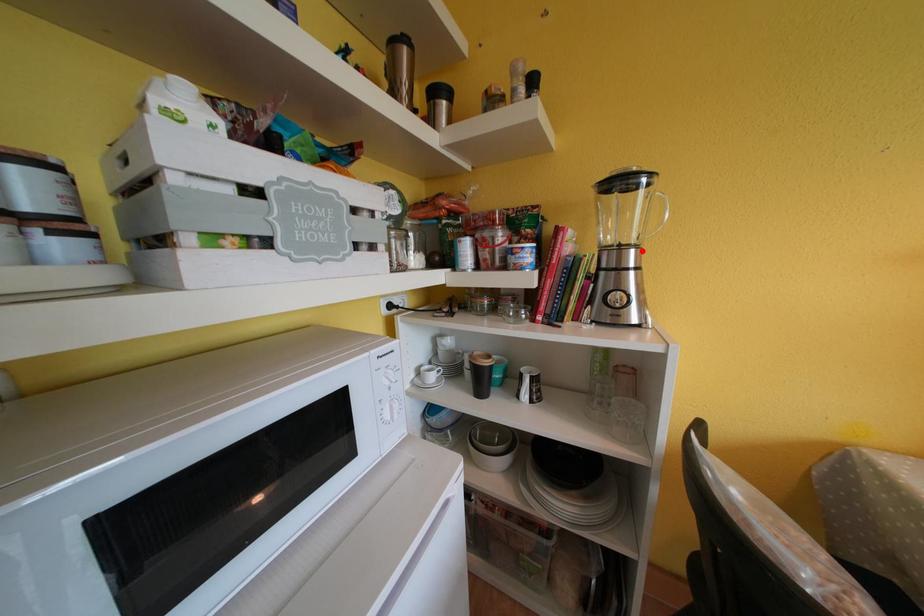
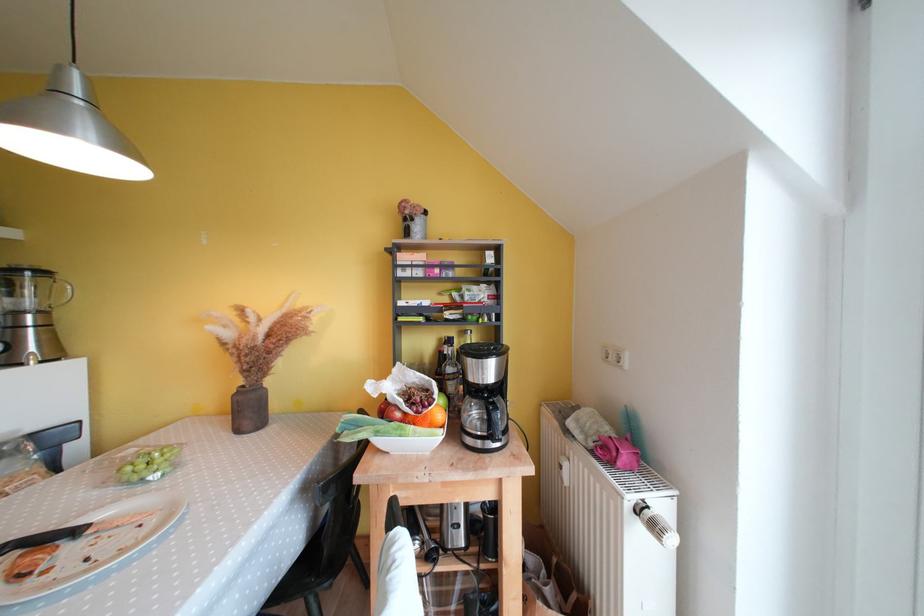
Where in the second image is the point corresponding to the highlighted location from the first image?

(49, 315)